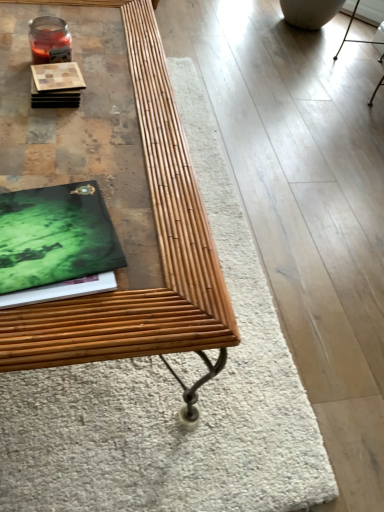
Locate an element on the screen. free area in between green matte book at left and wooden coaster at upper left is located at coordinates (58, 145).